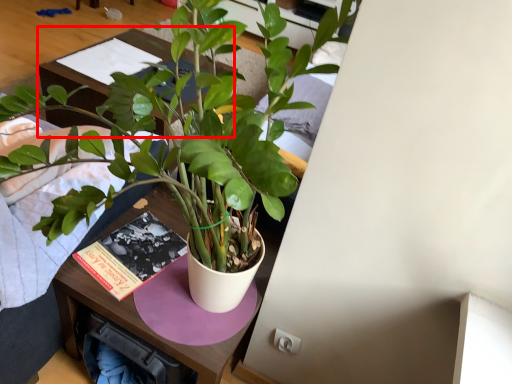
Question: From the image's perspective, what is the correct spatial positioning of table (annotated by the red box) in reference to houseplant?

Choices:
 (A) above
 (B) below

Answer: (A)